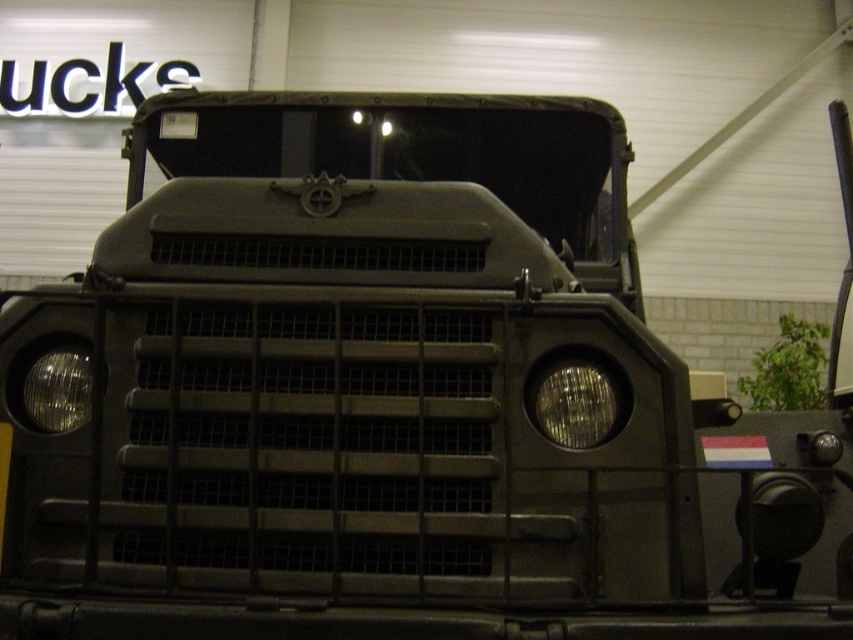
Question: Which of the following is the farthest from the observer?

Choices:
 (A) matte black headlight at right
 (B) clear glass headlight at center

Answer: (B)

Question: Can you confirm if matte black headlight at right is wider than clear glass headlight at center?

Choices:
 (A) no
 (B) yes

Answer: (B)

Question: Can you confirm if matte black headlight at right is thinner than clear glass headlight at center?

Choices:
 (A) yes
 (B) no

Answer: (B)

Question: Among these points, which one is farthest from the camera?

Choices:
 (A) (540, 403)
 (B) (53, 355)

Answer: (B)

Question: Observing the image, what is the correct spatial positioning of matte black headlight at right in reference to clear glass headlight at center?

Choices:
 (A) below
 (B) above

Answer: (A)